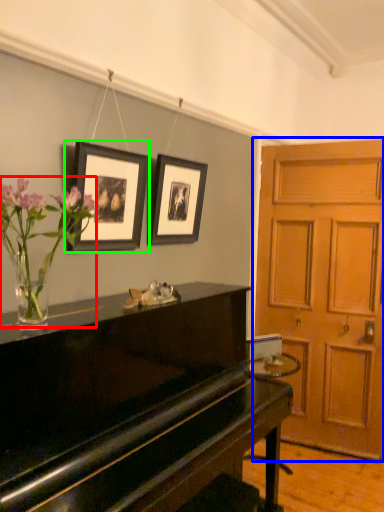
Question: Which object is positioned closest to floral arrangement (highlighted by a red box)? Select from door (highlighted by a blue box) and picture frame (highlighted by a green box).

Choices:
 (A) door
 (B) picture frame

Answer: (B)